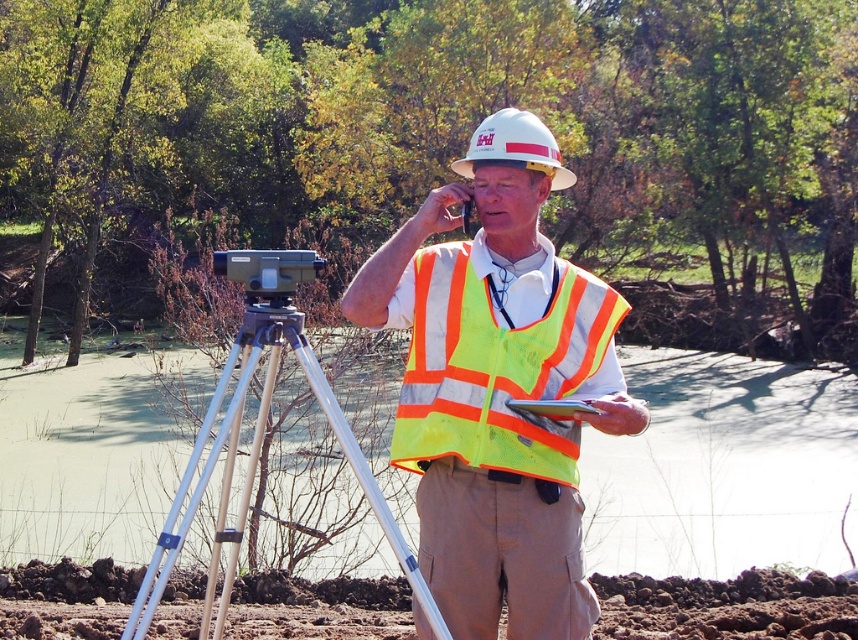
Question: Among these points, which one is farthest from the camera?

Choices:
 (A) (170, 513)
 (B) (487, 435)
 (C) (560, 604)

Answer: (C)

Question: Can you confirm if neon yellow reflective vest at center is positioned to the left of high-visibility reflective safety vest at center?

Choices:
 (A) yes
 (B) no

Answer: (A)

Question: Which object is closer to the camera taking this photo?

Choices:
 (A) dirt field at lower center
 (B) khaki cotton pants at center
 (C) silver metallic tripod at center
 (D) white hard hat at center

Answer: (C)

Question: Is neon yellow reflective vest at center positioned before khaki cotton pants at center?

Choices:
 (A) yes
 (B) no

Answer: (A)

Question: From the image, what is the correct spatial relationship of dirt field at lower center in relation to high-visibility reflective safety vest at center?

Choices:
 (A) left
 (B) right

Answer: (A)

Question: Which of these objects is positioned farthest from the silver metallic tripod at center?

Choices:
 (A) high-visibility reflective safety vest at center
 (B) white hard hat at center
 (C) khaki cotton pants at center

Answer: (B)